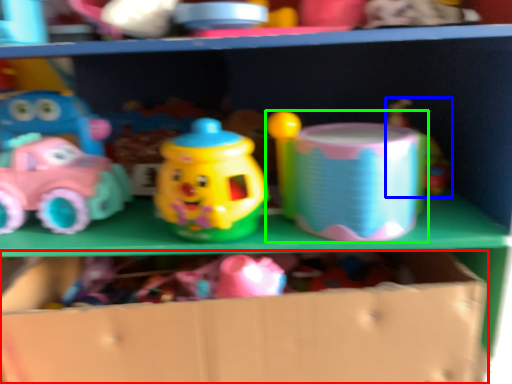
Question: Considering the real-world distances, which object is closest to cardboard box (highlighted by a red box)? toy (highlighted by a blue box) or toy (highlighted by a green box).

Choices:
 (A) toy
 (B) toy

Answer: (B)